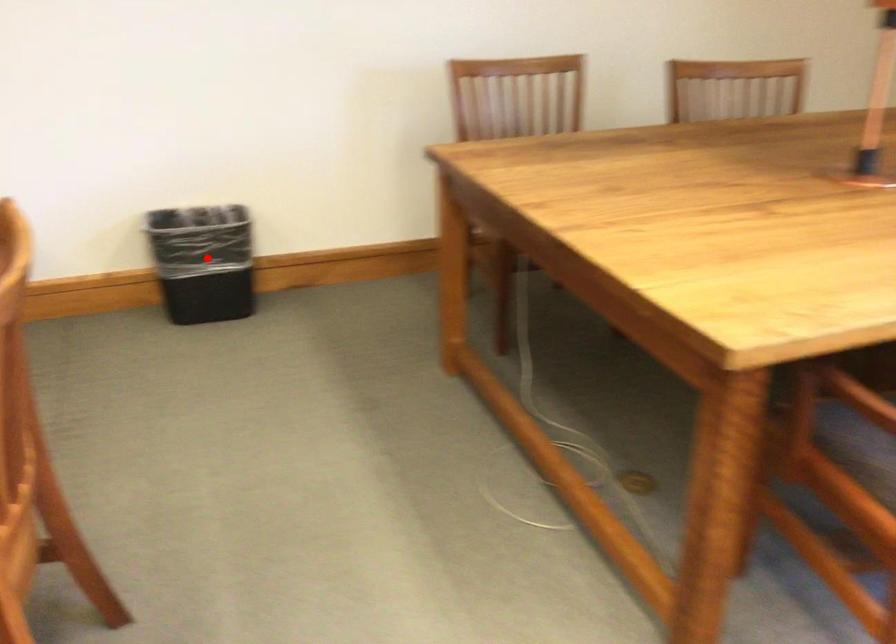
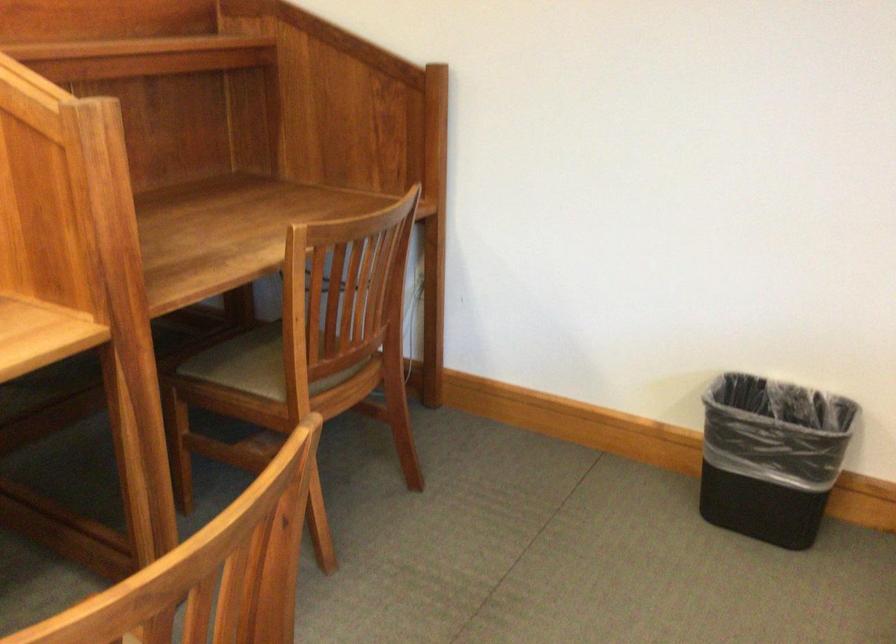
Question: I am providing you with two images of the same scene from different viewpoints. A red point is marked on the first image. At the location where the point appears in image 1, is it still visible in image 2?

Choices:
 (A) Yes
 (B) No

Answer: (A)